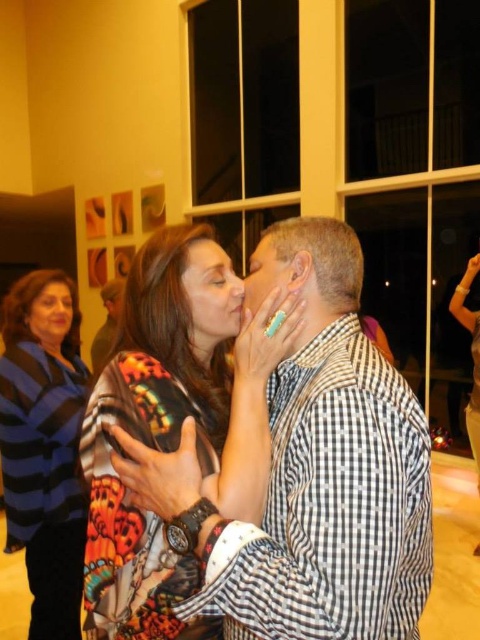
Question: Where is matte skin face at center located in relation to matte black face at upper left in the image?

Choices:
 (A) below
 (B) above

Answer: (B)

Question: Which of the following is the farthest from the observer?

Choices:
 (A) matte skin face at center
 (B) matte skin at center

Answer: (B)

Question: Which of these objects is positioned farthest from the printed silk blouse at center?

Choices:
 (A) matte black face at upper left
 (B) blue striped sweater at left

Answer: (A)

Question: Does blue striped sweater at left appear under matte black face at upper left?

Choices:
 (A) yes
 (B) no

Answer: (A)

Question: Which point is farther to the camera?

Choices:
 (A) matte skin face at center
 (B) matte black face at upper left
 (C) blue striped sweater at left

Answer: (B)

Question: Does blue striped sweater at left appear under matte skin at center?

Choices:
 (A) no
 (B) yes

Answer: (B)